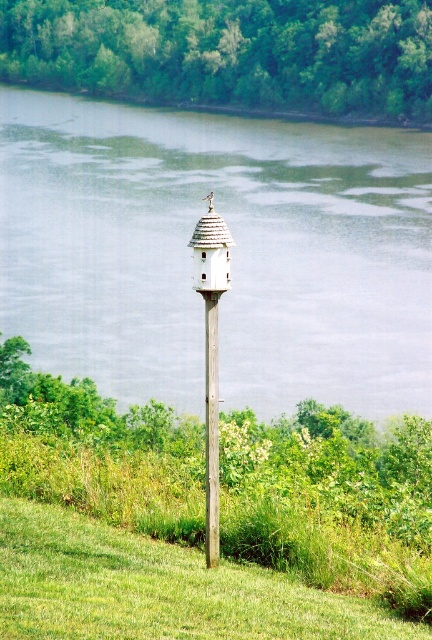
Question: Does green grassy hillside at center have a larger size compared to white wood pole at center?

Choices:
 (A) yes
 (B) no

Answer: (A)

Question: Is green water at center smaller than green grassy hillside at center?

Choices:
 (A) no
 (B) yes

Answer: (A)

Question: Which point is farther to the camera?

Choices:
 (A) green grassy hillside at center
 (B) white wood birdhouse at center

Answer: (A)

Question: Which point appears closest to the camera in this image?

Choices:
 (A) (396, 84)
 (B) (41, 534)

Answer: (B)

Question: Can you confirm if white wood birdhouse at center is wider than white wood pole at center?

Choices:
 (A) yes
 (B) no

Answer: (A)

Question: Among these points, which one is farthest from the camera?

Choices:
 (A) (224, 236)
 (B) (209, 435)
 (C) (292, 93)
 (D) (143, 630)

Answer: (C)